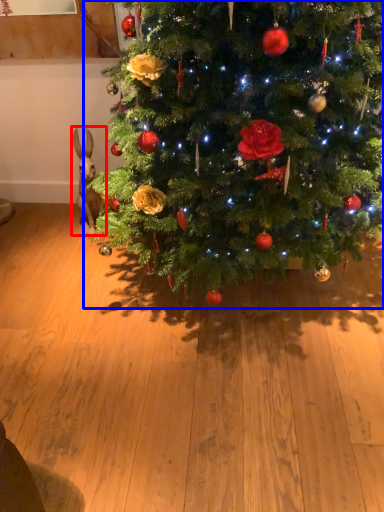
Question: Among these objects, which one is nearest to the camera, animal (highlighted by a red box) or christmas tree (highlighted by a blue box)?

Choices:
 (A) animal
 (B) christmas tree

Answer: (B)